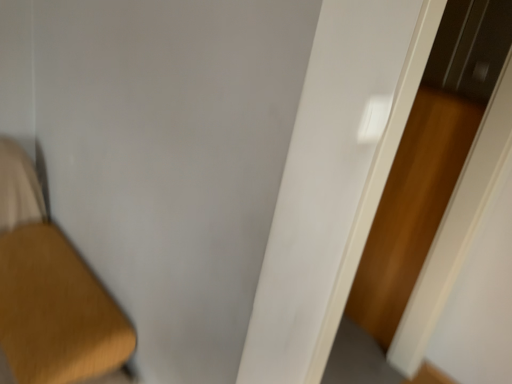
The width and height of the screenshot is (512, 384). What are the coordinates of `white glossy door at center` in the screenshot? It's located at (334, 179).

This screenshot has height=384, width=512. What do you see at coordinates (334, 179) in the screenshot?
I see `white glossy door at center` at bounding box center [334, 179].

In order to face wooden screen door at right, should I rotate leftwards or rightwards?

Rotate right and turn 18.928 degrees.

What do you see at coordinates (429, 159) in the screenshot? The height and width of the screenshot is (384, 512). I see `wooden screen door at right` at bounding box center [429, 159].

What is the approximate width of wooden screen door at right?

It is 14.82 inches.

Where is `wooden screen door at right`? The width and height of the screenshot is (512, 384). wooden screen door at right is located at coordinates (429, 159).

Identify the location of white glossy door at center. The width and height of the screenshot is (512, 384). (334, 179).

Considering the relative positions of white glossy door at center and wooden screen door at right in the image provided, is white glossy door at center to the left or to the right of wooden screen door at right?

Based on their positions, white glossy door at center is located to the left of wooden screen door at right.

Considering their positions, is white glossy door at center located in front of or behind wooden screen door at right?

Clearly, white glossy door at center is in front of wooden screen door at right.

Does point (282, 232) come closer to viewer compared to point (425, 80)?

That is True.

From the image's perspective, is white glossy door at center under wooden screen door at right?

Yes, from the image's perspective, white glossy door at center is below wooden screen door at right.

From a real-world perspective, which object stands above the other?

white glossy door at center, from a real-world perspective.

Can you confirm if white glossy door at center is wider than wooden screen door at right?

Incorrect, the width of white glossy door at center does not surpass that of wooden screen door at right.

Considering the sizes of white glossy door at center and wooden screen door at right in the image, is white glossy door at center taller or shorter than wooden screen door at right?

Considering their sizes, white glossy door at center has more height than wooden screen door at right.

Considering the relative sizes of white glossy door at center and wooden screen door at right in the image provided, is white glossy door at center bigger than wooden screen door at right?

Yes, white glossy door at center is bigger than wooden screen door at right.

Is white glossy door at center positioned beyond the bounds of wooden screen door at right?

Absolutely, white glossy door at center is external to wooden screen door at right.

Consider the image. Is white glossy door at center in contact with wooden screen door at right?

There is a gap between white glossy door at center and wooden screen door at right.

Is wooden screen door at right at the back of white glossy door at center?

No, wooden screen door at right is not at the back of white glossy door at center.

Where is `door in front of the wooden screen door at right`? The image size is (512, 384). door in front of the wooden screen door at right is located at coordinates (334, 179).

Considering the relative positions of wooden screen door at right and white glossy door at center in the image provided, is wooden screen door at right to the right of white glossy door at center from the viewer's perspective?

Indeed, wooden screen door at right is positioned on the right side of white glossy door at center.

Between wooden screen door at right and white glossy door at center, which one is positioned in front?

white glossy door at center is closer to the camera.

Is point (395, 279) less distant than point (297, 122)?

No, it is behind (297, 122).

From the image's perspective, which is above, wooden screen door at right or white glossy door at center?

From the image's view, wooden screen door at right is above.

From a real-world perspective, which object stands above the other?

white glossy door at center.

Between wooden screen door at right and white glossy door at center, which one has smaller width?

With smaller width is white glossy door at center.

From their relative heights in the image, would you say wooden screen door at right is taller or shorter than white glossy door at center?

wooden screen door at right is shorter than white glossy door at center.

Based on their sizes in the image, would you say wooden screen door at right is bigger or smaller than white glossy door at center?

wooden screen door at right is smaller than white glossy door at center.

Would you say white glossy door at center is part of wooden screen door at right's contents?

That's incorrect, white glossy door at center is not inside wooden screen door at right.

Is wooden screen door at right not close to white glossy door at center?

Absolutely, wooden screen door at right is distant from white glossy door at center.

Is wooden screen door at right facing towards white glossy door at center?

No, wooden screen door at right is not aimed at white glossy door at center.

The width and height of the screenshot is (512, 384). I want to click on screen door below the white glossy door at center (from a real-world perspective), so click(x=429, y=159).

Where is `door in front of the wooden screen door at right`? The width and height of the screenshot is (512, 384). door in front of the wooden screen door at right is located at coordinates (334, 179).

This screenshot has width=512, height=384. Identify the location of door on the left side of wooden screen door at right. (334, 179).